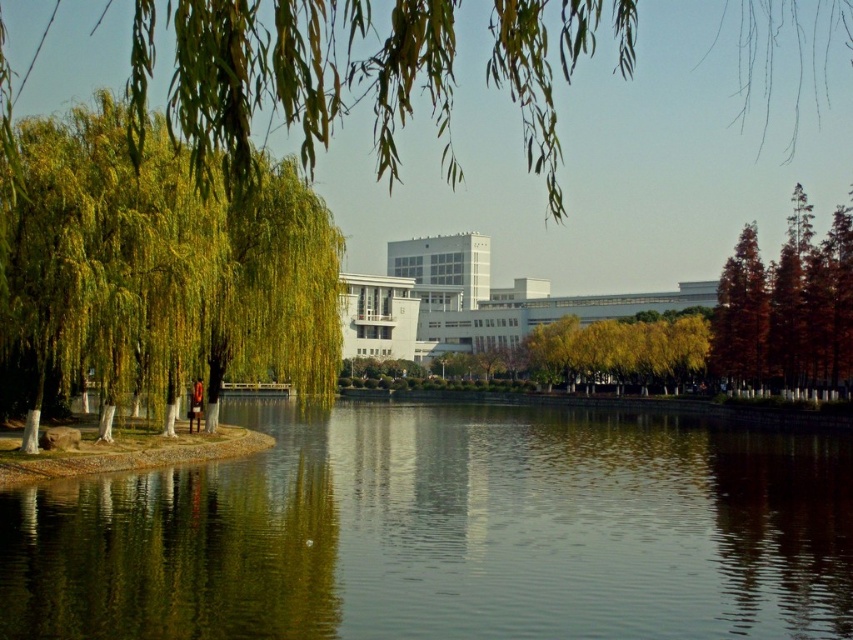
Does green leafy willow at left have a smaller size compared to reddish-brown smooth tree at right?

Actually, green leafy willow at left might be larger than reddish-brown smooth tree at right.

Between green leafy willow at left and reddish-brown smooth tree at right, which one appears on the right side from the viewer's perspective?

reddish-brown smooth tree at right is more to the right.

The image size is (853, 640). I want to click on green leafy willow at left, so click(x=161, y=268).

Is green reflective water at center wider than green leafy willow at left?

Yes.

Describe the element at coordinates (445, 531) in the screenshot. The width and height of the screenshot is (853, 640). I see `green reflective water at center` at that location.

Locate an element on the screen. green reflective water at center is located at coordinates (445, 531).

Is the position of orange matte tree at right more distant than that of reddish-brown smooth tree at right?

No, orange matte tree at right is closer to the viewer.

Who is positioned more to the left, orange matte tree at right or reddish-brown smooth tree at right?

From the viewer's perspective, reddish-brown smooth tree at right appears more on the left side.

The width and height of the screenshot is (853, 640). What do you see at coordinates (787, 307) in the screenshot?
I see `orange matte tree at right` at bounding box center [787, 307].

Locate an element on the screen. This screenshot has height=640, width=853. orange matte tree at right is located at coordinates (787, 307).